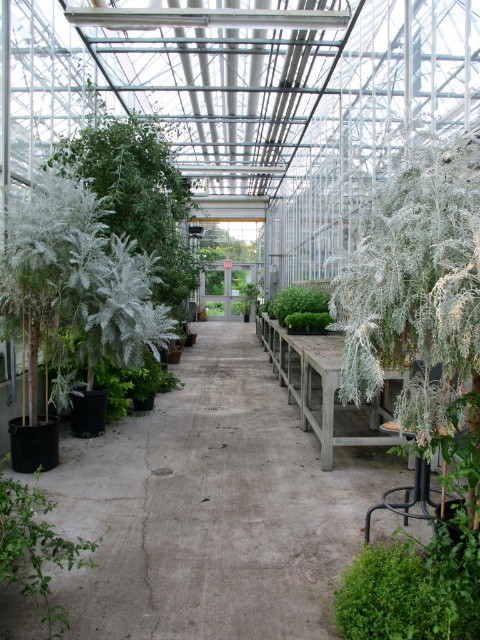
Does point (156, 280) come behind point (288, 305)?

No, (156, 280) is in front of (288, 305).

Can you confirm if silvery-green foliage at left is positioned to the left of green fuzzy plant at center?

Correct, you'll find silvery-green foliage at left to the left of green fuzzy plant at center.

Does point (64, 227) come behind point (294, 292)?

No, it is in front of (294, 292).

Locate an element on the screen. The image size is (480, 640). silvery-green foliage at left is located at coordinates (76, 282).

Between point (431, 323) and point (60, 298), which one is positioned in front?

Positioned in front is point (431, 323).

Where is `silvery-white feathery plant at right`? The image size is (480, 640). silvery-white feathery plant at right is located at coordinates (416, 288).

Based on the photo, who is positioned more to the right, silvery-green foliage at left or green matte plant at lower left?

From the viewer's perspective, green matte plant at lower left appears more on the right side.

Does silvery-green foliage at left have a greater height compared to green matte plant at lower left?

Indeed, silvery-green foliage at left has a greater height compared to green matte plant at lower left.

Is point (129, 300) more distant than point (12, 492)?

That is True.

Locate an element on the screen. This screenshot has height=640, width=480. silvery-green foliage at left is located at coordinates (76, 282).